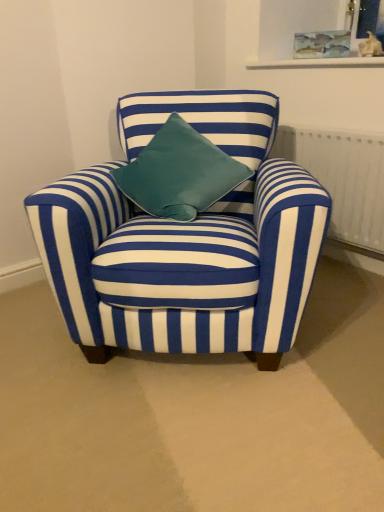
The height and width of the screenshot is (512, 384). What do you see at coordinates (186, 241) in the screenshot? I see `blue striped fabric chair at center` at bounding box center [186, 241].

In order to face watercolor paper picture frame at upper center, should I rotate leftwards or rightwards?

You should rotate right by 16.746 degrees.

Locate an element on the screen. The height and width of the screenshot is (512, 384). white textured radiator at right is located at coordinates (343, 182).

From a real-world perspective, is white textured radiator at right on top of watercolor paper picture frame at upper center?

No, from a real-world perspective, white textured radiator at right is not on top of watercolor paper picture frame at upper center.

Based on the photo, is white textured radiator at right oriented away from watercolor paper picture frame at upper center?

No, white textured radiator at right's orientation is not away from watercolor paper picture frame at upper center.

Which object is thinner, white textured radiator at right or watercolor paper picture frame at upper center?

watercolor paper picture frame at upper center.

Can watercolor paper picture frame at upper center be found inside white textured radiator at right?

No, watercolor paper picture frame at upper center is not inside white textured radiator at right.

Is white textured radiator at right oriented away from blue striped fabric chair at center?

No, white textured radiator at right is not facing the opposite direction of blue striped fabric chair at center.

The height and width of the screenshot is (512, 384). What are the coordinates of `radiator below the blue striped fabric chair at center (from a real-world perspective)` in the screenshot? It's located at (343, 182).

Between point (284, 126) and point (297, 252), which one is positioned behind?

Point (284, 126)

Is white textured radiator at right outside of blue striped fabric chair at center?

That's correct, white textured radiator at right is outside of blue striped fabric chair at center.

Considering the sizes of objects watercolor paper picture frame at upper center and white textured radiator at right in the image provided, who is bigger, watercolor paper picture frame at upper center or white textured radiator at right?

white textured radiator at right is bigger.

Is watercolor paper picture frame at upper center next to white textured radiator at right?

No.

Which is behind, point (335, 46) or point (321, 162)?

The point (335, 46) is more distant.

You are a GUI agent. You are given a task and a screenshot of the screen. Output one action in this format:
    pyautogui.click(x=<x>, y=<y>)
    Task: Click on the radiator that is under the watercolor paper picture frame at upper center (from a real-world perspective)
    Image resolution: width=384 pixels, height=512 pixels.
    Given the screenshot: What is the action you would take?
    pyautogui.click(x=343, y=182)

Measure the distance from watercolor paper picture frame at upper center to blue striped fabric chair at center.

watercolor paper picture frame at upper center is 1.15 meters from blue striped fabric chair at center.

Considering the relative sizes of watercolor paper picture frame at upper center and blue striped fabric chair at center in the image provided, is watercolor paper picture frame at upper center smaller than blue striped fabric chair at center?

Indeed, watercolor paper picture frame at upper center has a smaller size compared to blue striped fabric chair at center.

Would you say watercolor paper picture frame at upper center is inside or outside blue striped fabric chair at center?

watercolor paper picture frame at upper center lies outside blue striped fabric chair at center.

Is watercolor paper picture frame at upper center touching blue striped fabric chair at center?

No, watercolor paper picture frame at upper center is not touching blue striped fabric chair at center.

Is blue striped fabric chair at center oriented towards watercolor paper picture frame at upper center?

No, blue striped fabric chair at center does not turn towards watercolor paper picture frame at upper center.

From the image's perspective, which one is positioned lower, blue striped fabric chair at center or watercolor paper picture frame at upper center?

blue striped fabric chair at center appears lower in the image.

Is blue striped fabric chair at center bigger than watercolor paper picture frame at upper center?

Correct, blue striped fabric chair at center is larger in size than watercolor paper picture frame at upper center.

Is blue striped fabric chair at center placed right next to watercolor paper picture frame at upper center?

blue striped fabric chair at center and watercolor paper picture frame at upper center are not in contact.

Which is behind, point (187, 241) or point (350, 214)?

Positioned behind is point (350, 214).

From the picture: Is blue striped fabric chair at center aimed at white textured radiator at right?

No, blue striped fabric chair at center is not turned towards white textured radiator at right.

Does blue striped fabric chair at center have a greater width compared to white textured radiator at right?

Correct, the width of blue striped fabric chair at center exceeds that of white textured radiator at right.

Which of these two, blue striped fabric chair at center or white textured radiator at right, is smaller?

white textured radiator at right is smaller.

Locate an element on the screen. picture frame above the white textured radiator at right (from a real-world perspective) is located at coordinates (322, 44).

Image resolution: width=384 pixels, height=512 pixels. In order to click on radiator on the right of blue striped fabric chair at center in this screenshot , I will do `click(343, 182)`.

Estimate the real-world distances between objects in this image. Which object is further from blue striped fabric chair at center, white textured radiator at right or watercolor paper picture frame at upper center?

The object further to blue striped fabric chair at center is watercolor paper picture frame at upper center.

Based on their spatial positions, is watercolor paper picture frame at upper center or white textured radiator at right closer to blue striped fabric chair at center?

The object closer to blue striped fabric chair at center is white textured radiator at right.

When comparing their distances from white textured radiator at right, does blue striped fabric chair at center or watercolor paper picture frame at upper center seem closer?

Among the two, watercolor paper picture frame at upper center is located nearer to white textured radiator at right.

Considering their positions, is white textured radiator at right positioned closer to watercolor paper picture frame at upper center than blue striped fabric chair at center?

white textured radiator at right lies closer to watercolor paper picture frame at upper center than the other object.

Which object lies nearer to the anchor point white textured radiator at right, watercolor paper picture frame at upper center or blue striped fabric chair at center?

watercolor paper picture frame at upper center is positioned closer to the anchor white textured radiator at right.

When comparing their distances from watercolor paper picture frame at upper center, does blue striped fabric chair at center or white textured radiator at right seem further?

blue striped fabric chair at center is positioned further to the anchor watercolor paper picture frame at upper center.

Image resolution: width=384 pixels, height=512 pixels. I want to click on radiator between blue striped fabric chair at center and watercolor paper picture frame at upper center from front to back, so click(343, 182).